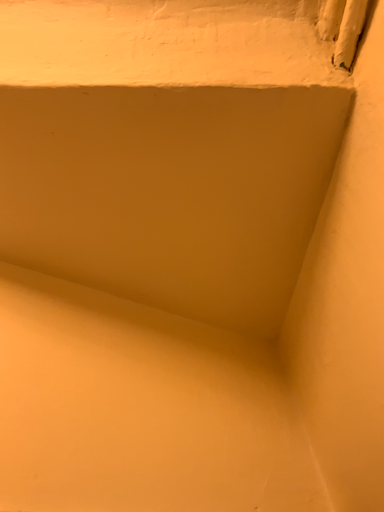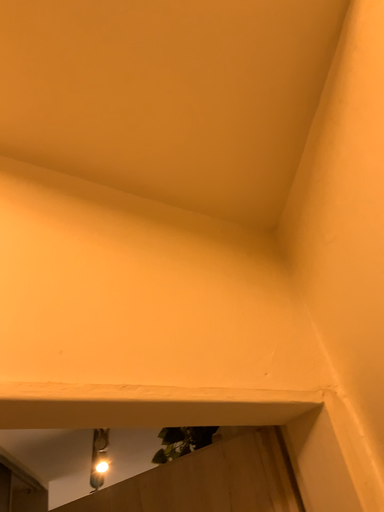
Question: Which way did the camera rotate in the video?

Choices:
 (A) rotated upward
 (B) rotated downward

Answer: (B)